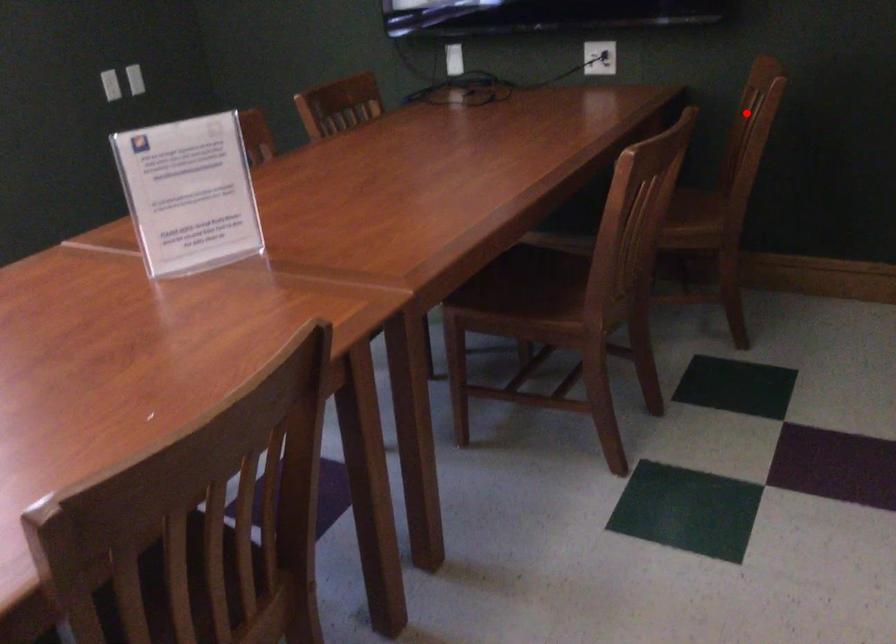
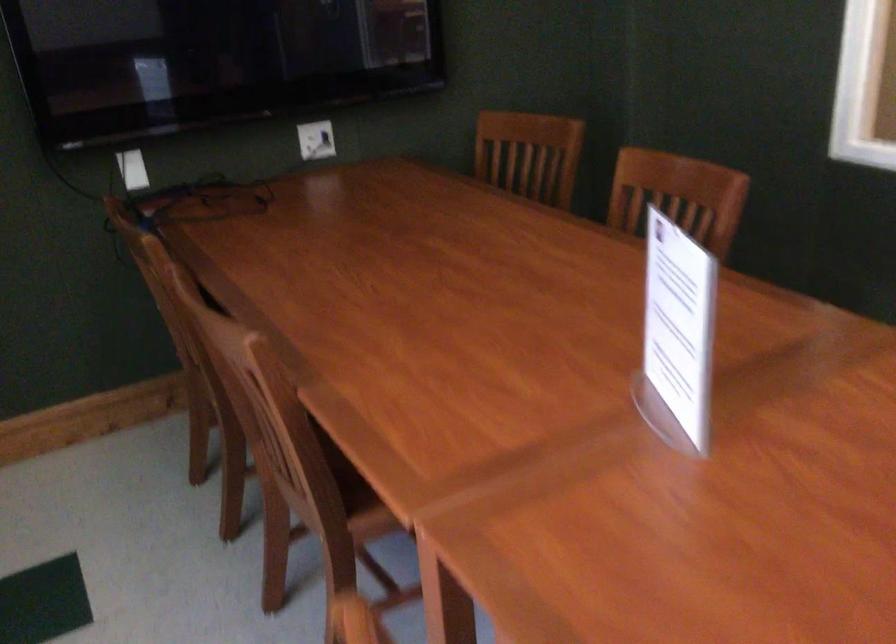
In the second image, find the point that corresponds to the highlighted location in the first image.

(529, 154)